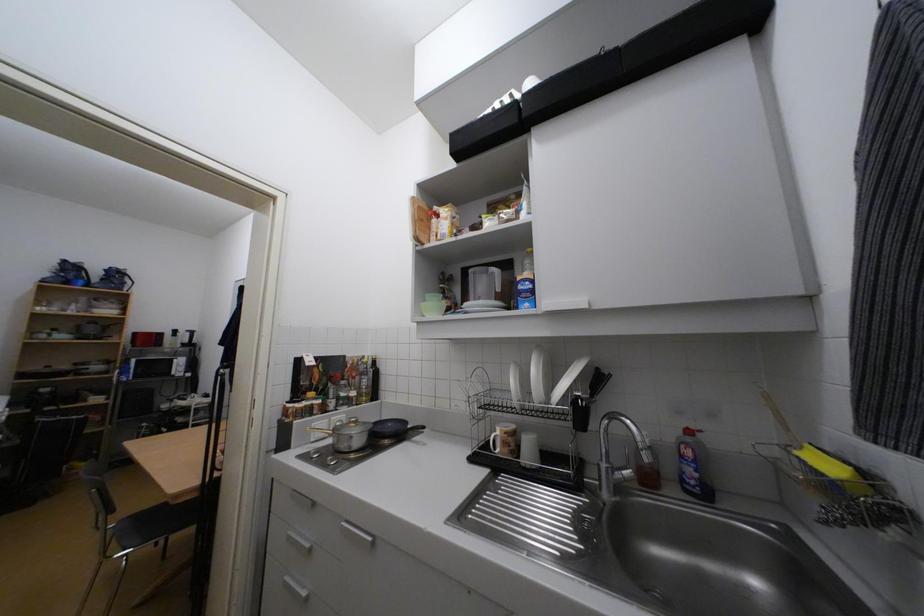
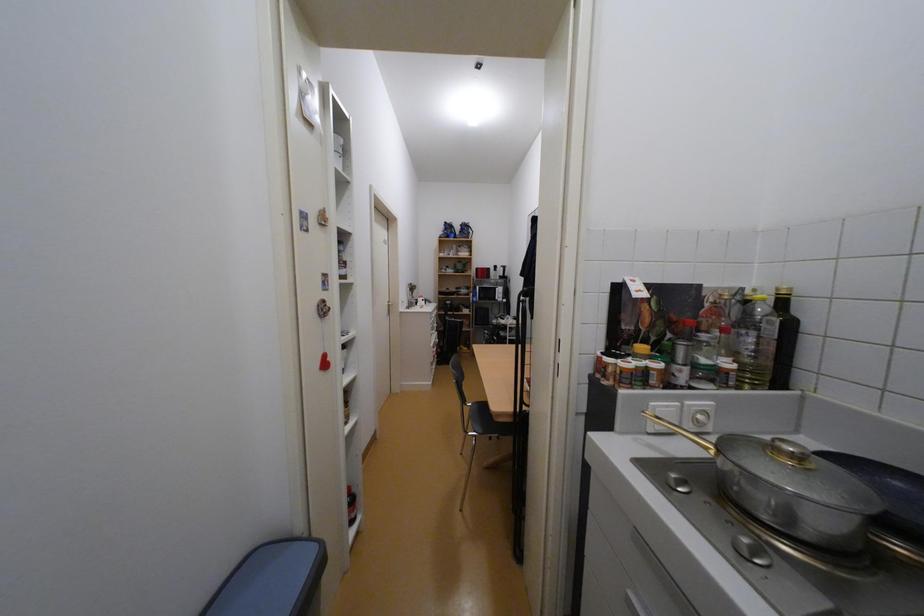
Question: Based on the continuous images, in which direction is the camera rotating? Reply with the corresponding letter.

Choices:
 (A) Left
 (B) Right
 (C) Up
 (D) Down

Answer: (A)